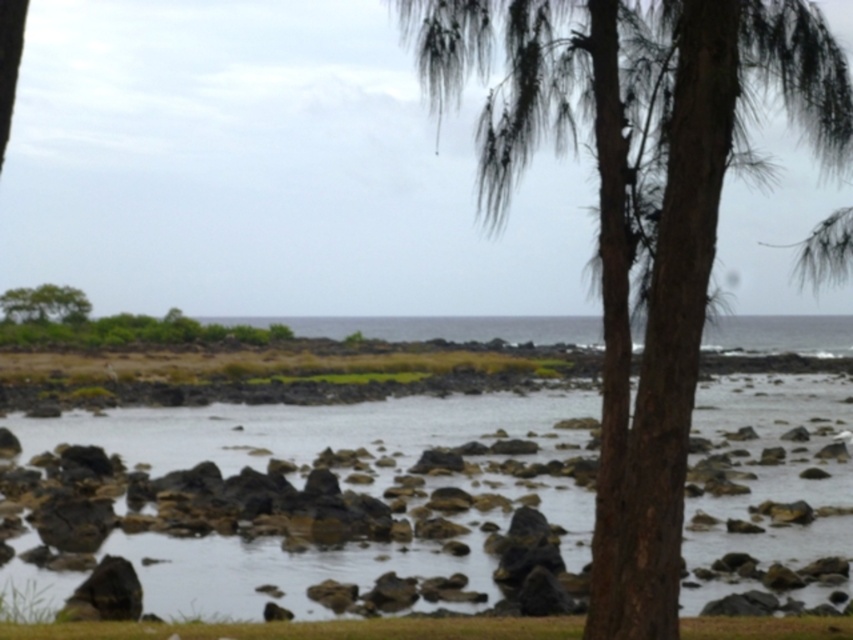
Is brown rough bark palm tree at right to the left of green leafy tree at upper left from the viewer's perspective?

No, brown rough bark palm tree at right is not to the left of green leafy tree at upper left.

Does point (833, 72) come behind point (57, 305)?

That is False.

The height and width of the screenshot is (640, 853). I want to click on brown rough bark palm tree at right, so click(x=637, y=208).

Locate an element on the screen. The image size is (853, 640). brown rough bark palm tree at right is located at coordinates (637, 208).

Who is shorter, clear water at center or green leafy tree at upper left?

With less height is clear water at center.

Does clear water at center have a lesser width compared to green leafy tree at upper left?

Incorrect, clear water at center's width is not less than green leafy tree at upper left's.

Which is behind, point (482, 593) or point (78, 301)?

The point (78, 301) is behind.

Locate an element on the screen. The image size is (853, 640). clear water at center is located at coordinates click(300, 502).

Can you confirm if clear water at center is positioned below brown rough bark palm tree at right?

Yes.

Which of these two, clear water at center or brown rough bark palm tree at right, stands shorter?

clear water at center is shorter.

Does point (10, 545) come farther from viewer compared to point (589, 88)?

Yes, it is.

You are a GUI agent. You are given a task and a screenshot of the screen. Output one action in this format:
    pyautogui.click(x=<x>, y=<y>)
    Task: Click on the clear water at center
    The image size is (853, 640).
    Given the screenshot: What is the action you would take?
    pyautogui.click(x=300, y=502)